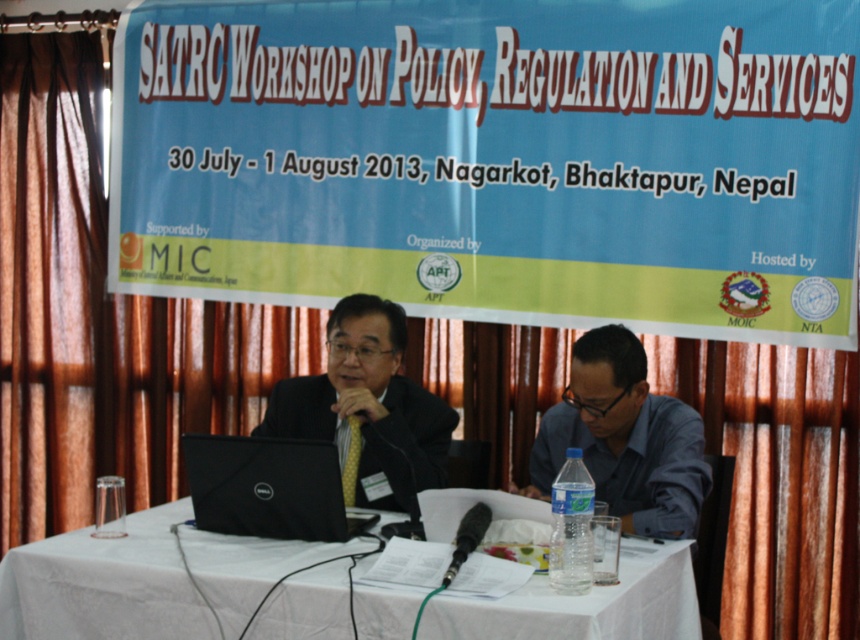
Question: Which of the following is the farthest from the observer?

Choices:
 (A) (286, 406)
 (B) (624, 515)

Answer: (A)

Question: Does blue shirt at center come in front of black matte suit at center?

Choices:
 (A) no
 (B) yes

Answer: (B)

Question: Does blue shirt at center appear on the left side of black matte laptop at center?

Choices:
 (A) yes
 (B) no

Answer: (B)

Question: Which object is closer to the camera taking this photo?

Choices:
 (A) white cloth-covered table at center
 (B) blue shirt at center
 (C) black matte laptop at center
 (D) black matte suit at center

Answer: (A)

Question: In this image, where is white cloth-covered table at center located relative to black matte laptop at center?

Choices:
 (A) below
 (B) above

Answer: (A)

Question: Which object is the farthest from the black matte suit at center?

Choices:
 (A) black matte laptop at center
 (B) blue shirt at center

Answer: (B)